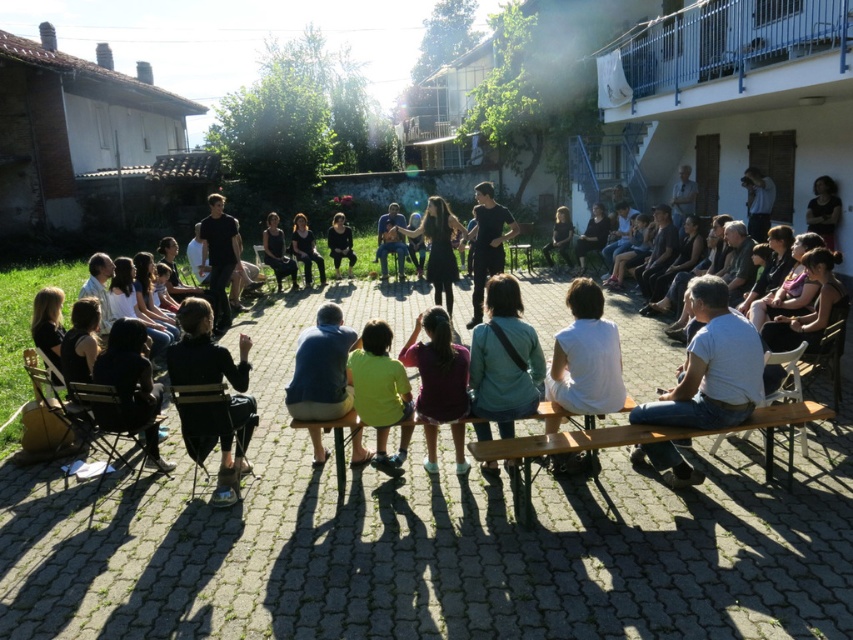
Question: Observing the image, what is the correct spatial positioning of matte purple shirt at center in reference to green matte shirt at center?

Choices:
 (A) below
 (B) above

Answer: (B)

Question: Which of the following is the farthest from the observer?

Choices:
 (A) (399, 372)
 (B) (428, 326)
 (C) (798, 419)

Answer: (B)

Question: Which of these objects is positioned farthest from the green matte shirt at center?

Choices:
 (A) wooden park bench at center
 (B) matte purple shirt at center

Answer: (A)

Question: Can you confirm if wooden park bench at center is bigger than green matte shirt at center?

Choices:
 (A) yes
 (B) no

Answer: (A)

Question: Is wooden park bench at center wider than matte purple shirt at center?

Choices:
 (A) no
 (B) yes

Answer: (B)

Question: Which is farther from the matte purple shirt at center?

Choices:
 (A) green matte shirt at center
 (B) wooden park bench at center

Answer: (B)